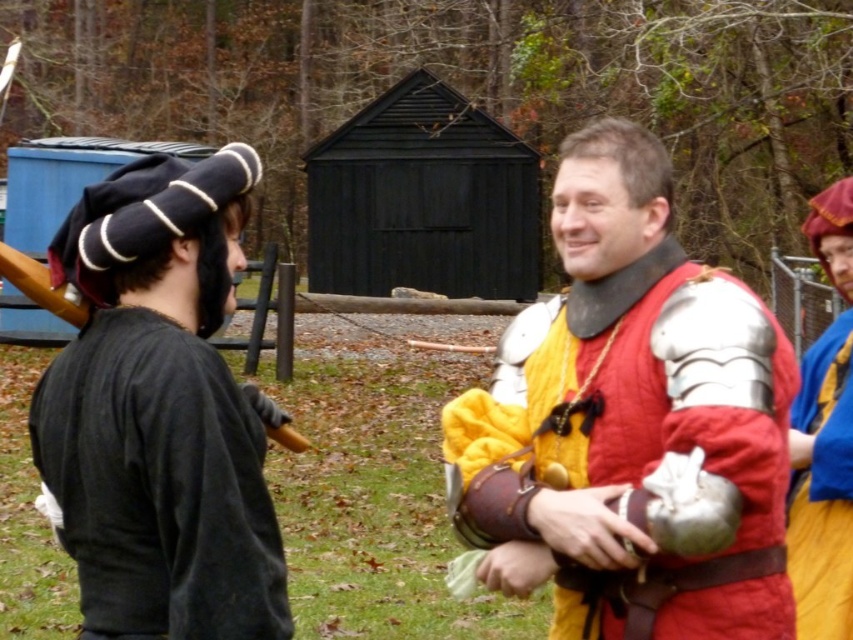
Question: Can you confirm if metallic armor at center is positioned below black velvet hat at left?

Choices:
 (A) no
 (B) yes

Answer: (A)

Question: Which object is the closest to the black velvet hat at left?

Choices:
 (A) velvet blue robe at right
 (B) metallic armor at center

Answer: (B)

Question: Does black velvet hat at left have a larger size compared to velvet blue robe at right?

Choices:
 (A) no
 (B) yes

Answer: (B)

Question: Which point appears farthest from the camera in this image?

Choices:
 (A) (845, 561)
 (B) (642, 324)

Answer: (A)

Question: Is metallic armor at center bigger than black velvet hat at left?

Choices:
 (A) yes
 (B) no

Answer: (A)

Question: Which point is closer to the camera?

Choices:
 (A) velvet blue robe at right
 (B) black velvet hat at left

Answer: (B)